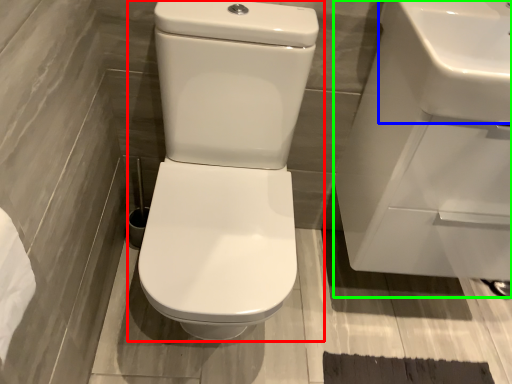
Question: Which object is the closest to the toilet (highlighted by a red box)? Choose among these: sink (highlighted by a blue box) or sink (highlighted by a green box).

Choices:
 (A) sink
 (B) sink

Answer: (B)